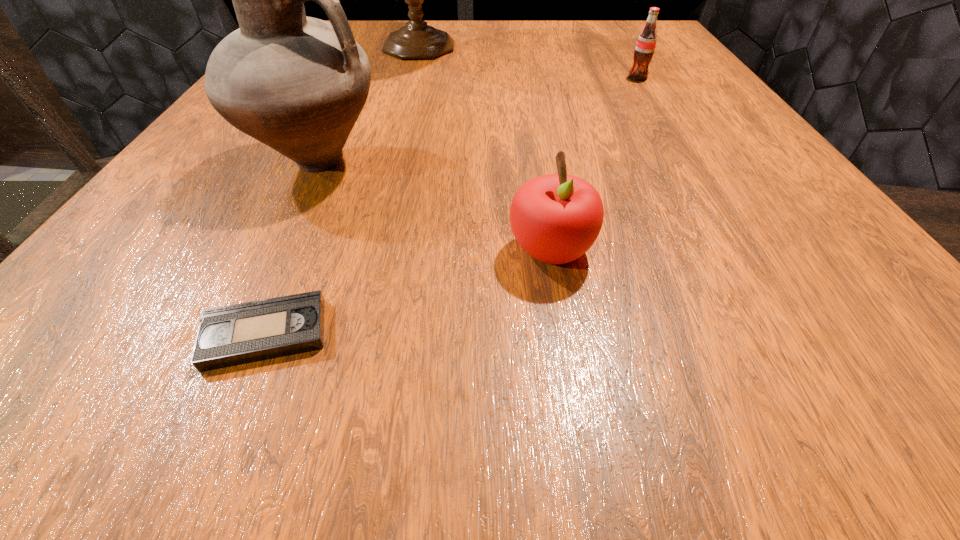
The width and height of the screenshot is (960, 540). Find the location of `vacant space that satisfies the following two spatial constraints: 1. on the handle side of the shortest object; 2. on the left side of the third farthest object`. vacant space that satisfies the following two spatial constraints: 1. on the handle side of the shortest object; 2. on the left side of the third farthest object is located at coordinates (234, 334).

At what (x,y) coordinates should I click in order to perform the action: click on free region that satisfies the following two spatial constraints: 1. on the front of the globe showing Asia; 2. on the left side of the second object from right to left. Please return your answer as a coordinate pair (x, y). The width and height of the screenshot is (960, 540). Looking at the image, I should click on (365, 251).

Where is `vacant space that satisfies the following two spatial constraints: 1. on the back side of the fourth farthest object; 2. on the right side of the nearest object`? This screenshot has height=540, width=960. vacant space that satisfies the following two spatial constraints: 1. on the back side of the fourth farthest object; 2. on the right side of the nearest object is located at coordinates (300, 251).

The height and width of the screenshot is (540, 960). Identify the location of vacant area that satisfies the following two spatial constraints: 1. on the back side of the apple; 2. on the front of the globe showing Asia. (517, 48).

Locate an element on the screen. The width and height of the screenshot is (960, 540). blank space that satisfies the following two spatial constraints: 1. on the back side of the soda; 2. on the left side of the second nearest object is located at coordinates (522, 78).

You are a GUI agent. You are given a task and a screenshot of the screen. Output one action in this format:
    pyautogui.click(x=<x>, y=<y>)
    Task: Click on the vacant space that satisfies the following two spatial constraints: 1. on the front of the second nearest object showing Asia; 2. on the left side of the tallest object
    
    Given the screenshot: What is the action you would take?
    pyautogui.click(x=365, y=251)